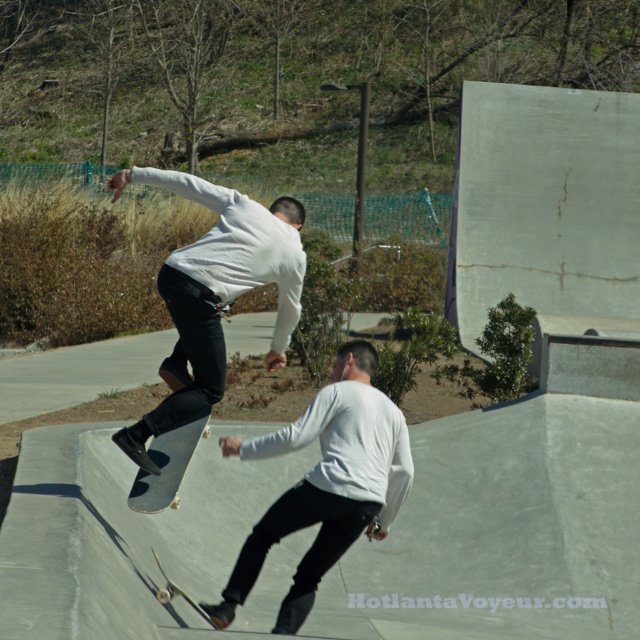
Based on the photo, you are standing at the skatepark and see the matte white shirt at center. If you want to take a photo of it with your phone, which has a maximum focus range of 7 meters, will you be able to capture it clearly?

The matte white shirt at center is 7.49 meters away from the viewer. Since the phone can only focus up to 7 meters, it won t be able to capture the matte white shirt at center clearly.

You are a photographer at the skatepark and want to capture a photo of the matte white shirt at center and the wooden skateboard at lower center. Which object is higher in the image?

The matte white shirt at center is located above the wooden skateboard at lower center, so it is higher in the image.

You are standing at the skatepark and want to take a photo of the point at coordinates (237,202). If your camera has a maximum focus range of 25 feet, will you be able to capture the point clearly?

The point at coordinates (237,202) is 25.58 feet away from the viewer. Since the camera can only focus up to 25 feet, the point is slightly out of range and may not be captured clearly.